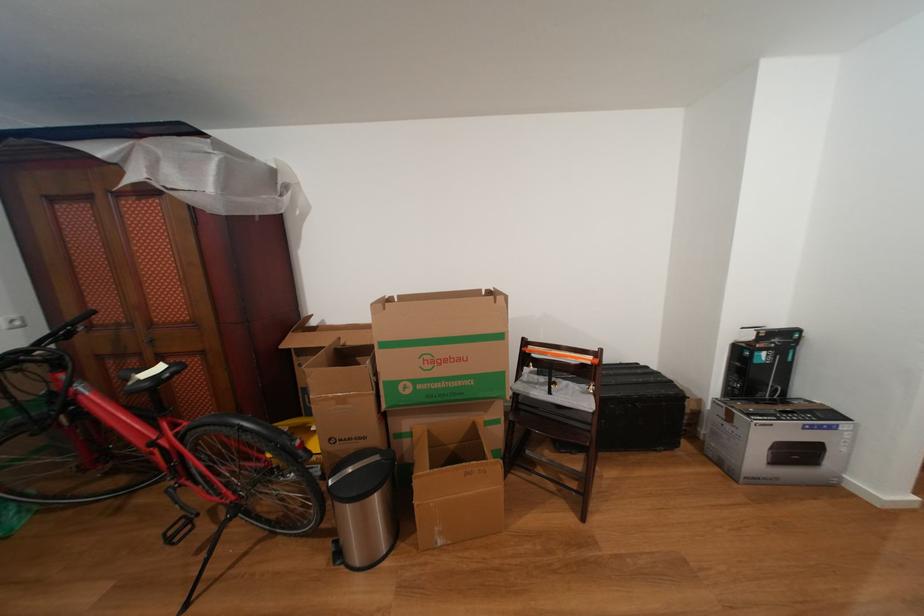
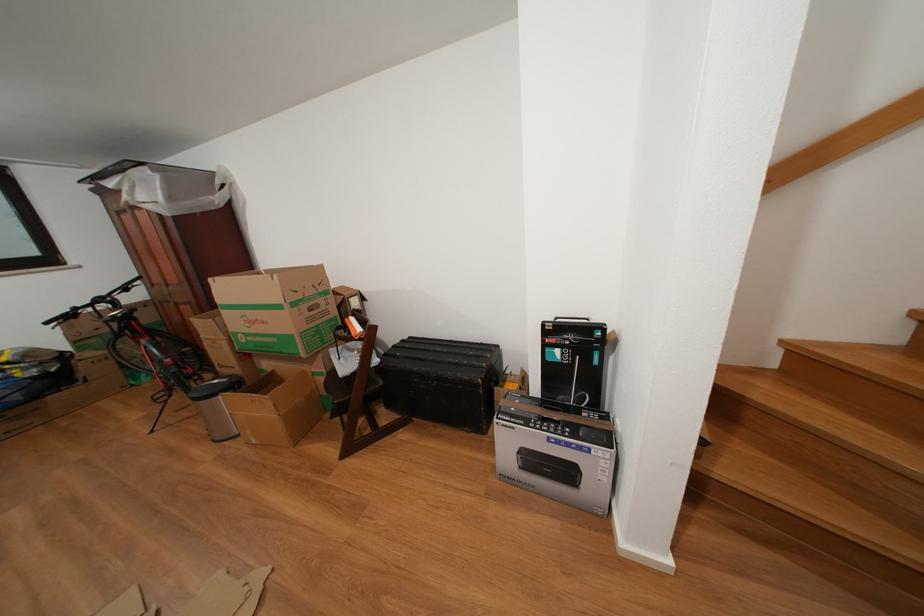
In the second image, find the point that corresponds to point (829, 432) in the first image.

(576, 450)